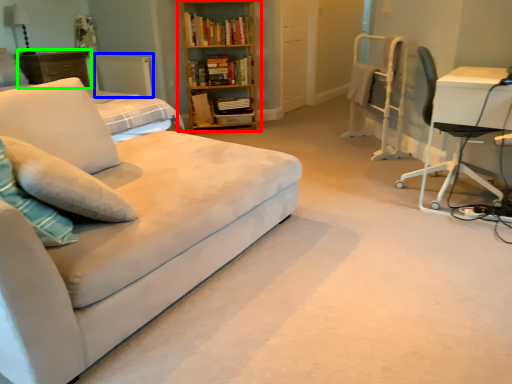
Question: Estimate the real-world distances between objects in this image. Which object is closer to bookcase (highlighted by a red box), radiator (highlighted by a blue box) or dresser (highlighted by a green box)?

Choices:
 (A) radiator
 (B) dresser

Answer: (A)